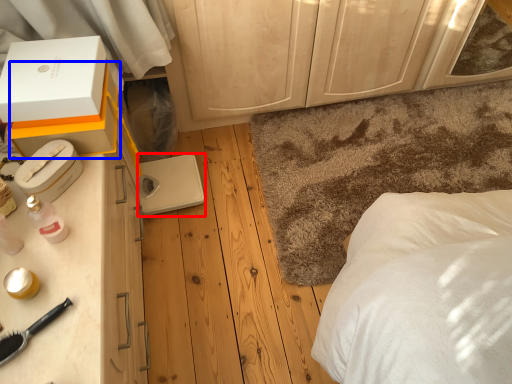
Question: Which object appears farthest to the camera in this image, appliance (highlighted by a red box) or box (highlighted by a blue box)?

Choices:
 (A) appliance
 (B) box

Answer: (A)